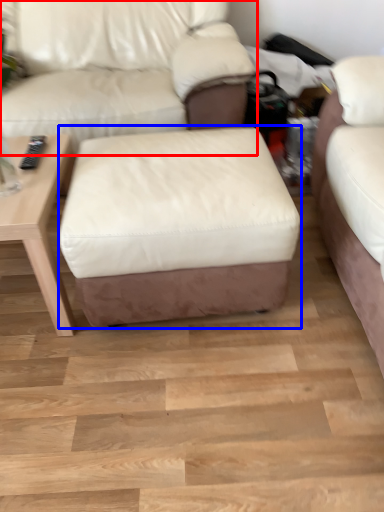
Question: Which object appears closest to the camera in this image, studio couch (highlighted by a red box) or stool (highlighted by a blue box)?

Choices:
 (A) studio couch
 (B) stool

Answer: (B)